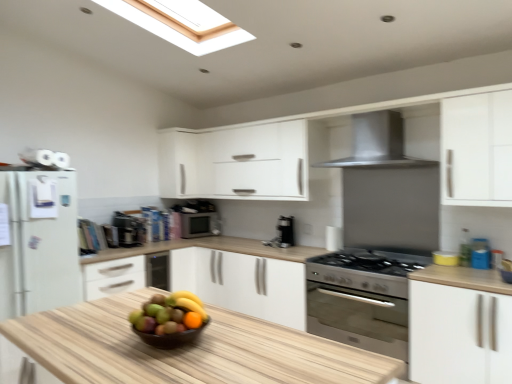
Question: Is shiny brown bowl at center positioned with its back to white matte cabinet at upper center, the first cabinetry when ordered from left to right?

Choices:
 (A) no
 (B) yes

Answer: (A)

Question: Would you say shiny brown bowl at center contains white matte cabinet at upper center, the 2th cabinetry positioned from the bottom?

Choices:
 (A) no
 (B) yes

Answer: (A)

Question: Can you confirm if shiny brown bowl at center is thinner than white matte cabinet at upper center, the 2th cabinetry positioned from the bottom?

Choices:
 (A) no
 (B) yes

Answer: (B)

Question: From a real-world perspective, is shiny brown bowl at center positioned over white matte cabinet at upper center, the 2th cabinetry positioned from the bottom, based on gravity?

Choices:
 (A) no
 (B) yes

Answer: (A)

Question: Can you confirm if shiny brown bowl at center is smaller than white matte cabinet at upper center, the first cabinetry positioned from the back?

Choices:
 (A) no
 (B) yes

Answer: (B)

Question: Is shiny brown bowl at center aimed at white matte cabinet at upper center, the first cabinetry positioned from the back?

Choices:
 (A) no
 (B) yes

Answer: (A)

Question: Considering the relative sizes of white matte cabinet at right, the first cabinetry viewed from the right, and metallic silver microwave at center, arranged as the 2th appliance when viewed from the left, in the image provided, is white matte cabinet at right, the first cabinetry viewed from the right, bigger than metallic silver microwave at center, arranged as the 2th appliance when viewed from the left,?

Choices:
 (A) yes
 (B) no

Answer: (A)

Question: Does white matte cabinet at right, which ranks as the second cabinetry in back-to-front order, come in front of metallic silver microwave at center, arranged as the 2th appliance when viewed from the front?

Choices:
 (A) yes
 (B) no

Answer: (A)

Question: Is white matte cabinet at right, which is the first cabinetry from front to back, taller than metallic silver microwave at center, arranged as the 2th appliance when viewed from the left?

Choices:
 (A) yes
 (B) no

Answer: (A)

Question: From the image's perspective, is white matte cabinet at right, which is counted as the 2th cabinetry, starting from the left, on metallic silver microwave at center, the 1th appliance from the back?

Choices:
 (A) yes
 (B) no

Answer: (B)

Question: Would you say white matte cabinet at right, which is the 1th cabinetry in bottom-to-top order, is outside metallic silver microwave at center, arranged as the 2th appliance when viewed from the left?

Choices:
 (A) no
 (B) yes

Answer: (B)

Question: From the image's perspective, is white matte cabinet at right, which is the 2th cabinetry from top to bottom, below metallic silver microwave at center, arranged as the 2th appliance when viewed from the front?

Choices:
 (A) no
 (B) yes

Answer: (B)

Question: Does shiny brown bowl at center turn towards satin black coffee maker at center, positioned as the 2th appliance in back-to-front order?

Choices:
 (A) no
 (B) yes

Answer: (A)